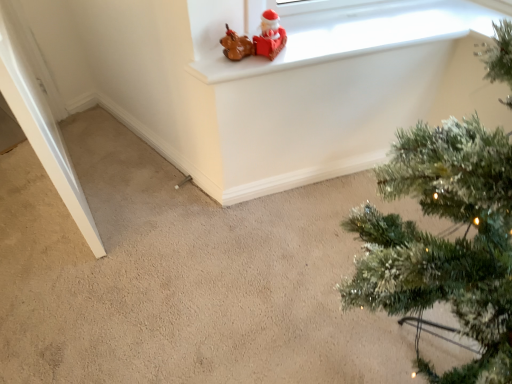
Question: Can you confirm if green textured christmas tree at upper right is positioned to the left of matte white window frame at upper center?

Choices:
 (A) no
 (B) yes

Answer: (A)

Question: Is green textured christmas tree at upper right wider than matte white window frame at upper center?

Choices:
 (A) yes
 (B) no

Answer: (A)

Question: Considering the relative sizes of green textured christmas tree at upper right and matte white window frame at upper center in the image provided, is green textured christmas tree at upper right thinner than matte white window frame at upper center?

Choices:
 (A) no
 (B) yes

Answer: (A)

Question: Does green textured christmas tree at upper right lie in front of matte white window frame at upper center?

Choices:
 (A) no
 (B) yes

Answer: (B)

Question: From the image's perspective, would you say green textured christmas tree at upper right is shown under matte white window frame at upper center?

Choices:
 (A) no
 (B) yes

Answer: (B)

Question: Considering the relative positions of matte brown figurine at upper center and matte white window frame at upper center in the image provided, is matte brown figurine at upper center to the left or to the right of matte white window frame at upper center?

Choices:
 (A) right
 (B) left

Answer: (B)

Question: From the image's perspective, is matte brown figurine at upper center above or below matte white window frame at upper center?

Choices:
 (A) above
 (B) below

Answer: (B)

Question: In the image, is matte brown figurine at upper center positioned in front of or behind matte white window frame at upper center?

Choices:
 (A) front
 (B) behind

Answer: (A)

Question: Is matte brown figurine at upper center bigger or smaller than matte white window frame at upper center?

Choices:
 (A) big
 (B) small

Answer: (B)

Question: Choose the correct answer: Is green textured christmas tree at upper right inside matte white window frame at upper center or outside it?

Choices:
 (A) outside
 (B) inside

Answer: (A)

Question: In terms of size, does green textured christmas tree at upper right appear bigger or smaller than matte white window frame at upper center?

Choices:
 (A) small
 (B) big

Answer: (B)

Question: Considering their positions, is green textured christmas tree at upper right located in front of or behind matte white window frame at upper center?

Choices:
 (A) behind
 (B) front

Answer: (B)

Question: Is point (486, 304) positioned closer to the camera than point (219, 82)?

Choices:
 (A) closer
 (B) farther

Answer: (A)

Question: Relative to green textured christmas tree at upper right, is matte brown figurine at upper center in front or behind?

Choices:
 (A) front
 (B) behind

Answer: (B)

Question: From the image's perspective, is matte brown figurine at upper center above or below green textured christmas tree at upper right?

Choices:
 (A) above
 (B) below

Answer: (A)